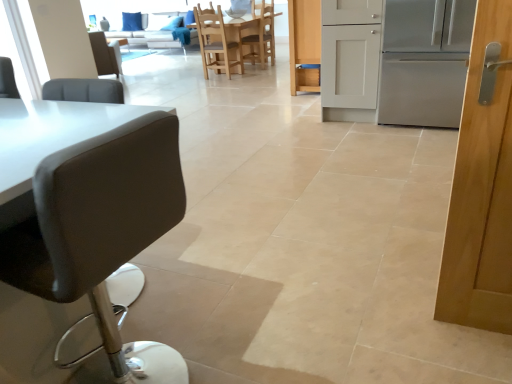
Question: From the image's perspective, is light brown wooden chair at center, placed as the first chair when sorted from back to front, on top of wooden chair at center, positioned as the second chair in front-to-back order?

Choices:
 (A) yes
 (B) no

Answer: (A)

Question: Is light brown wooden chair at center, placed as the fourth chair when sorted from left to right, wider than wooden chair at center, the second chair in the top-to-bottom sequence?

Choices:
 (A) yes
 (B) no

Answer: (B)

Question: From the image's perspective, is light brown wooden chair at center, arranged as the first chair when viewed from the right, under wooden chair at center, the 3th chair from the back?

Choices:
 (A) no
 (B) yes

Answer: (A)

Question: Is light brown wooden chair at center, marked as the 4th chair in a front-to-back arrangement, thinner than wooden chair at center, the 3th chair from the back?

Choices:
 (A) no
 (B) yes

Answer: (B)

Question: Considering the relative sizes of light brown wooden chair at center, marked as the 4th chair in a front-to-back arrangement, and wooden chair at center, which appears as the 2th chair when viewed from the left, in the image provided, is light brown wooden chair at center, marked as the 4th chair in a front-to-back arrangement, smaller than wooden chair at center, which appears as the 2th chair when viewed from the left,?

Choices:
 (A) yes
 (B) no

Answer: (B)

Question: Which is correct: black leather chair at upper left, placed as the fourth chair when sorted from right to left, is inside light brown wooden chair at center, marked as the 4th chair in a front-to-back arrangement, or outside of it?

Choices:
 (A) inside
 (B) outside

Answer: (B)

Question: Considering their positions, is black leather chair at upper left, placed as the fourth chair when sorted from right to left, located in front of or behind light brown wooden chair at center, the fourth chair in the bottom-to-top sequence?

Choices:
 (A) front
 (B) behind

Answer: (A)

Question: From the image's perspective, relative to light brown wooden chair at center, placed as the fourth chair when sorted from left to right, is black leather chair at upper left, which is counted as the 3th chair, starting from the front, above or below?

Choices:
 (A) above
 (B) below

Answer: (B)

Question: From their relative heights in the image, would you say black leather chair at upper left, marked as the 1th chair in a left-to-right arrangement, is taller or shorter than light brown wooden chair at center, marked as the first chair in a top-to-bottom arrangement?

Choices:
 (A) tall
 (B) short

Answer: (B)

Question: Considering the positions of light brown wooden chair at center, placed as the fourth chair when sorted from left to right, and stainless steel refrigerator at right in the image, is light brown wooden chair at center, placed as the fourth chair when sorted from left to right, bigger or smaller than stainless steel refrigerator at right?

Choices:
 (A) small
 (B) big

Answer: (A)

Question: From a real-world perspective, is light brown wooden chair at center, marked as the 4th chair in a front-to-back arrangement, above or below stainless steel refrigerator at right?

Choices:
 (A) above
 (B) below

Answer: (B)

Question: Which is correct: light brown wooden chair at center, marked as the 4th chair in a front-to-back arrangement, is inside stainless steel refrigerator at right, or outside of it?

Choices:
 (A) inside
 (B) outside

Answer: (B)

Question: From the image's perspective, is light brown wooden chair at center, placed as the fourth chair when sorted from left to right, above or below stainless steel refrigerator at right?

Choices:
 (A) below
 (B) above

Answer: (B)

Question: Choose the correct answer: Is stainless steel refrigerator at right inside white wood cabinet at center or outside it?

Choices:
 (A) outside
 (B) inside

Answer: (A)

Question: Is stainless steel refrigerator at right wider or thinner than white wood cabinet at center?

Choices:
 (A) wide
 (B) thin

Answer: (A)